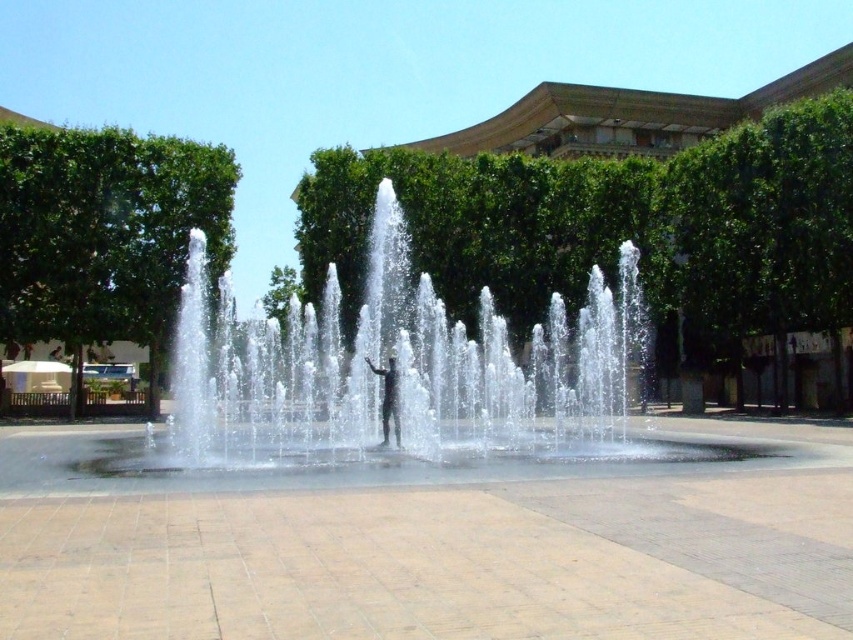
You are standing in the plaza and see the clear water at center and the black matte person at center. Which object is located to the right of the other?

The clear water at center is positioned on the right side of black matte person at center.

You are standing at the fountain in the plaza. You notice two points marked on the ground. The first point is at coordinates point (309, 342) and the second is at point (386, 378). Which point is closer to you if you are facing the building with the curved roofline?

Point (386, 378) is closer to you because it is in front of point (309, 342), which is behind it.